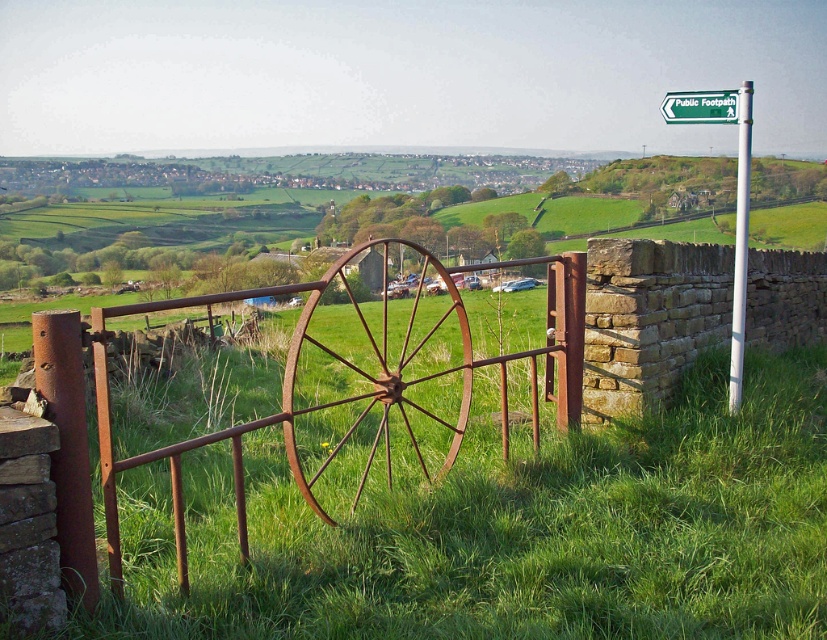
Based on the photo, you are a painter who wants to paint both the rusty metal wagon wheel at center and the green plastic sign at upper right. Since you need to bring your ladder, which object will require a taller ladder to reach?

The green plastic sign at upper right requires a taller ladder because it is located higher up at the upper right compared to the rusty metal wagon wheel at center, which is positioned lower at the center.

You are a hiker who has reached a fork in the path. You see a rusty metal gate at center and a green plastic signpost at upper right. According to the scene, which object is positioned to the left of the other?

The rusty metal gate at center is to the left of green plastic signpost at upper right.